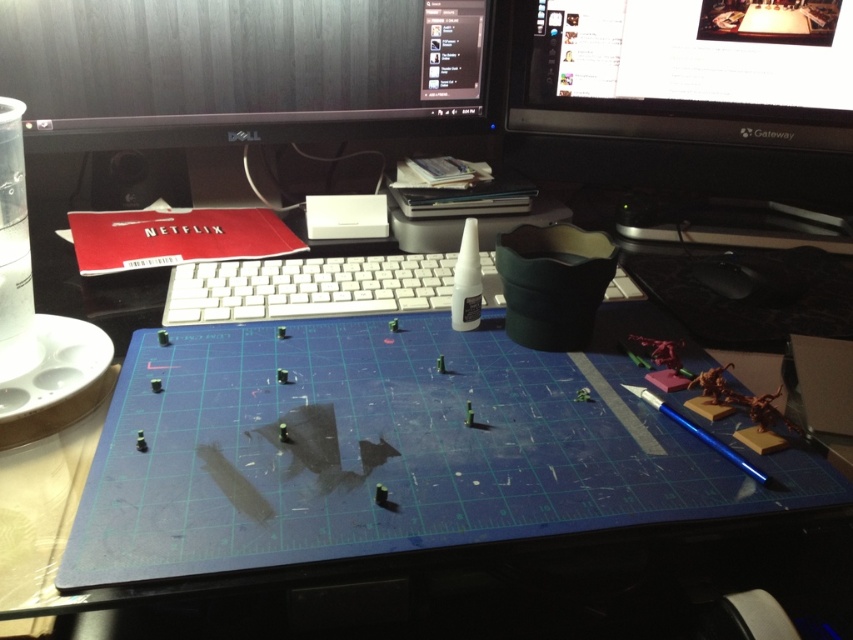
Looking at this image, you have a ruler that is 16 inches long. You need to measure the distance between the blue cutting mat at center and the red Netflix envelope to the left. Can your ruler reach the entire distance?

The distance between the blue cutting mat at center and the red Netflix envelope to the left is 17.33 inches. Since your ruler is only 16 inches long, it cannot fully measure the entire distance between them.

You are organizing your desk and need to move items to make space. If you want to place a new item between the blue cutting mat at center and the white plastic keyboard at center, where should you position it?

The blue cutting mat at center is to the right of the white plastic keyboard at center, so you should place the new item between them by positioning it to the left of the blue cutting mat and to the right of the white plastic keyboard at center.